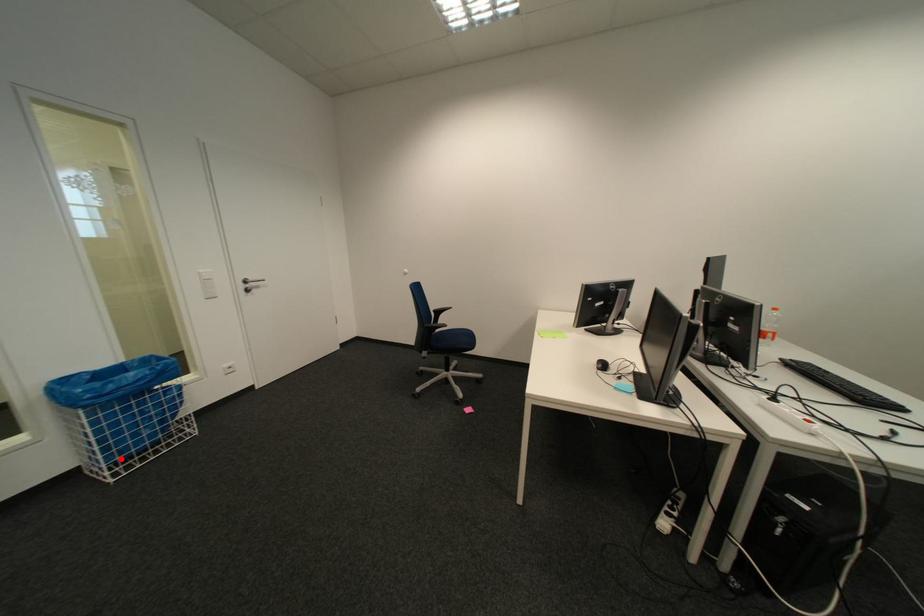
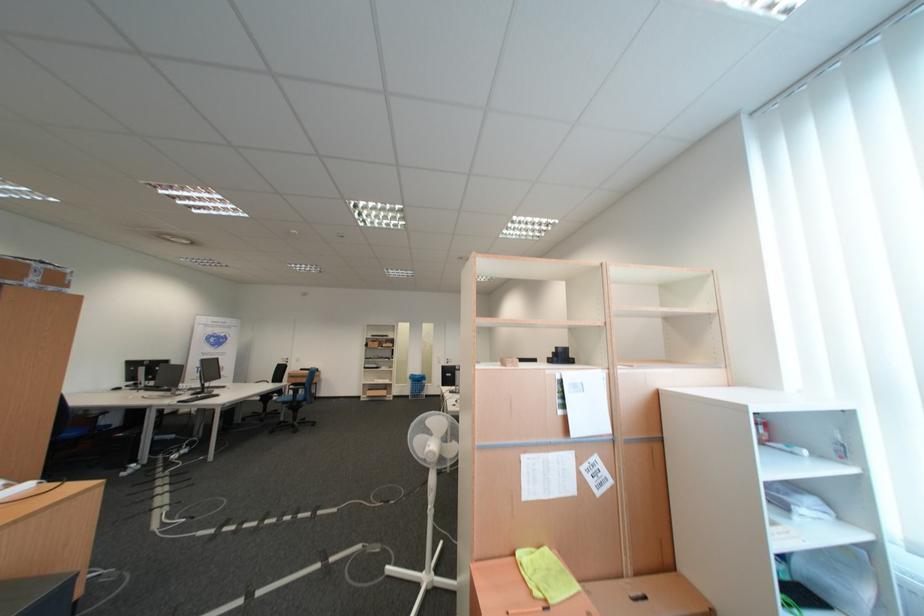
Locate, in the second image, the point that corresponds to the highlighted location in the first image.

(422, 394)